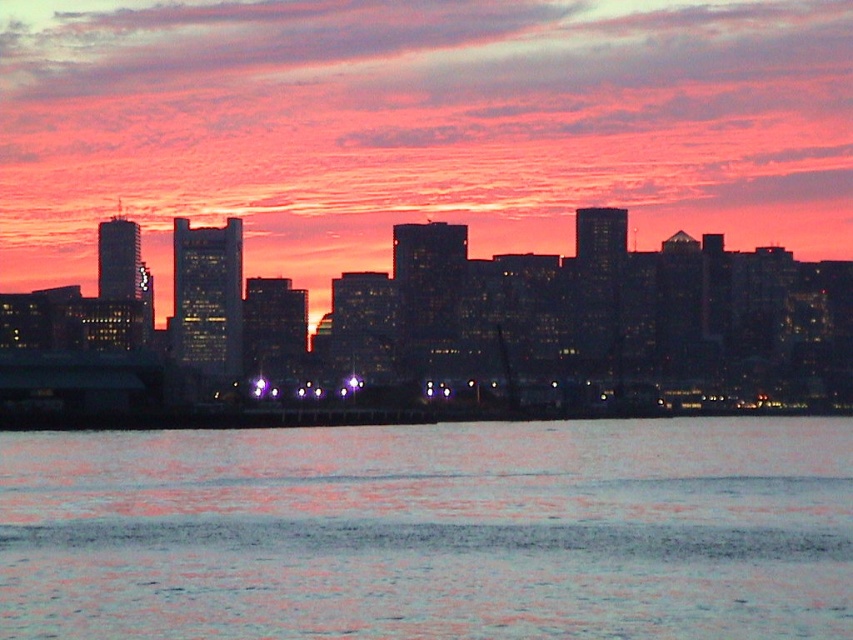
Question: Where is reflective silver water at lower center located in relation to black glass buildings at center in the image?

Choices:
 (A) right
 (B) left

Answer: (B)

Question: Is reflective silver water at lower center thinner than black glass buildings at center?

Choices:
 (A) yes
 (B) no

Answer: (A)

Question: Is reflective silver water at lower center wider than black glass buildings at center?

Choices:
 (A) no
 (B) yes

Answer: (A)

Question: Which point is farther from the camera taking this photo?

Choices:
 (A) (132, 225)
 (B) (310, 476)

Answer: (A)